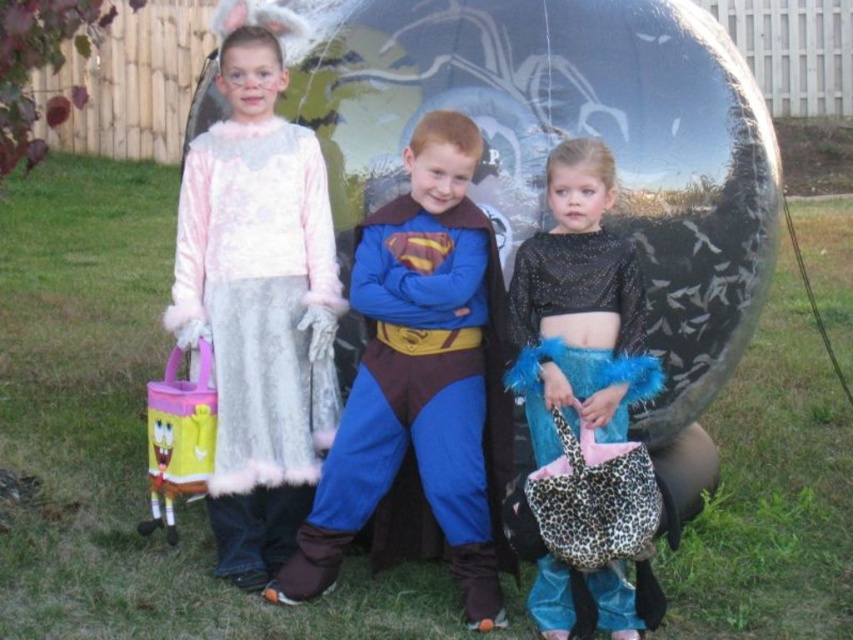
Consider the image. Which is more to the right, blue fabric superman costume at center or fuzzy white dress at center?

From the viewer's perspective, blue fabric superman costume at center appears more on the right side.

Find the location of `blue fabric superman costume at center`. blue fabric superman costume at center is located at coordinates (421, 387).

Does point (439, 202) come in front of point (241, 211)?

Yes, point (439, 202) is in front of point (241, 211).

Locate an element on the screen. The image size is (853, 640). blue fabric superman costume at center is located at coordinates pyautogui.click(x=421, y=387).

Does glossy black sphere at center appear under fuzzy white dress at center?

No, glossy black sphere at center is not below fuzzy white dress at center.

Is glossy black sphere at center bigger than fuzzy white dress at center?

Indeed, glossy black sphere at center has a larger size compared to fuzzy white dress at center.

The height and width of the screenshot is (640, 853). I want to click on glossy black sphere at center, so point(560,138).

The height and width of the screenshot is (640, 853). Identify the location of glossy black sphere at center. (560, 138).

Is point (302, 86) positioned in front of point (350, 531)?

No.

Between glossy black sphere at center and blue fabric superman costume at center, which one is positioned higher?

glossy black sphere at center

Is point (712, 388) in front of point (430, 317)?

No, it is behind (430, 317).

Locate an element on the screen. This screenshot has width=853, height=640. glossy black sphere at center is located at coordinates (560, 138).